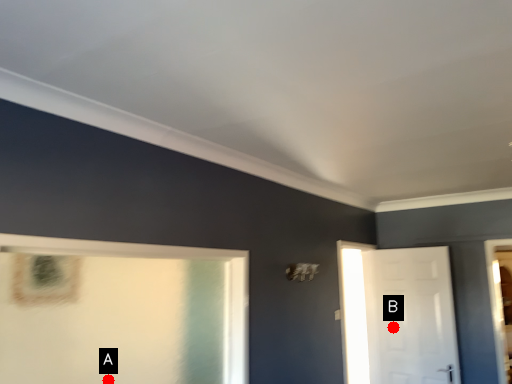
Question: Two points are circled on the image, labeled by A and B beside each circle. Which point is closer to the camera?

Choices:
 (A) A is closer
 (B) B is closer

Answer: (A)